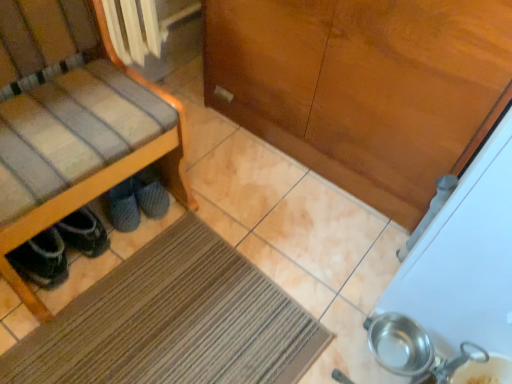
You are a GUI agent. You are given a task and a screenshot of the screen. Output one action in this format:
    pyautogui.click(x=<x>, y=<y>)
    Task: Click on the free spot above gray fuzzy slippers at lower left, which is counted as the 1th footwear, starting from the right (from a real-world perspective)
    The width and height of the screenshot is (512, 384).
    Given the screenshot: What is the action you would take?
    click(x=150, y=184)